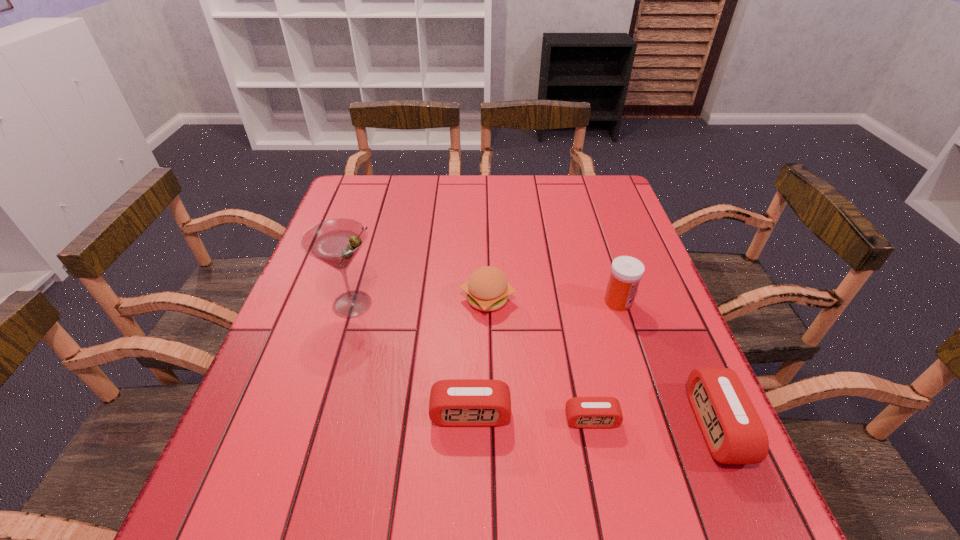
This screenshot has height=540, width=960. Find the location of `free spot at the far edge of the desktop`. free spot at the far edge of the desktop is located at coordinates (486, 214).

In the image, there is a desktop. What are the coordinates of `vacant space at the near edge` in the screenshot? It's located at tap(406, 451).

Find the location of `vacant space at the left edge of the desktop`. vacant space at the left edge of the desktop is located at coordinates (313, 347).

In the image, there is a desktop. Identify the location of vacant space at the right edge. Image resolution: width=960 pixels, height=540 pixels. (603, 225).

Locate an element on the screen. The width and height of the screenshot is (960, 540). vacant point at the far left corner is located at coordinates (386, 182).

In the image, there is a desktop. Find the location of `free space at the near left corner`. free space at the near left corner is located at coordinates (276, 430).

Identify the location of free space between the tallest object and the fourth object from left to right. (472, 362).

Locate an element on the screen. vacant space in between the leftmost object and the second shortest object is located at coordinates (412, 359).

Find the location of `free area in between the second object from right to left and the fifth tallest object`. free area in between the second object from right to left and the fifth tallest object is located at coordinates (544, 358).

Find the location of a particular element. This screenshot has width=960, height=540. free space that is in between the leftmost alarm clock and the hamburger is located at coordinates (479, 356).